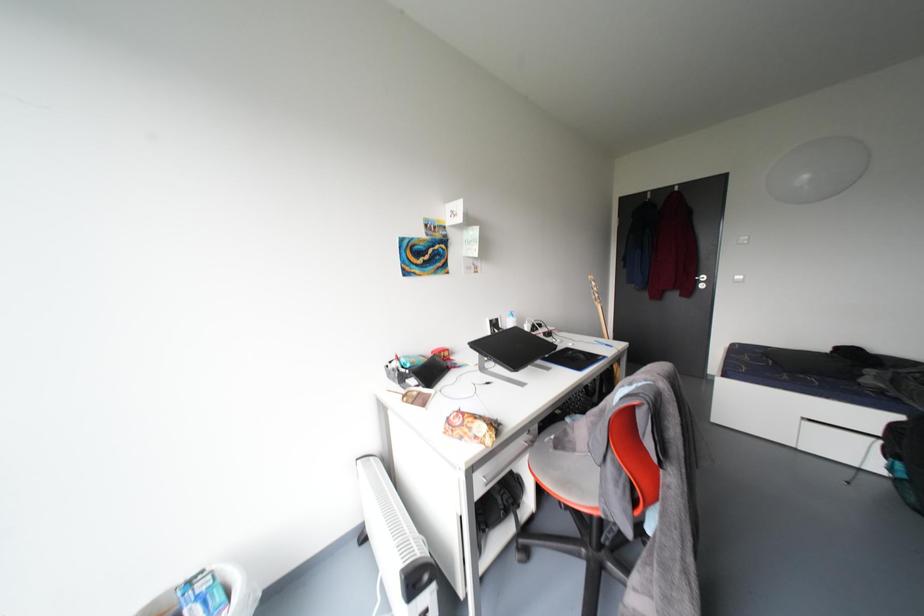
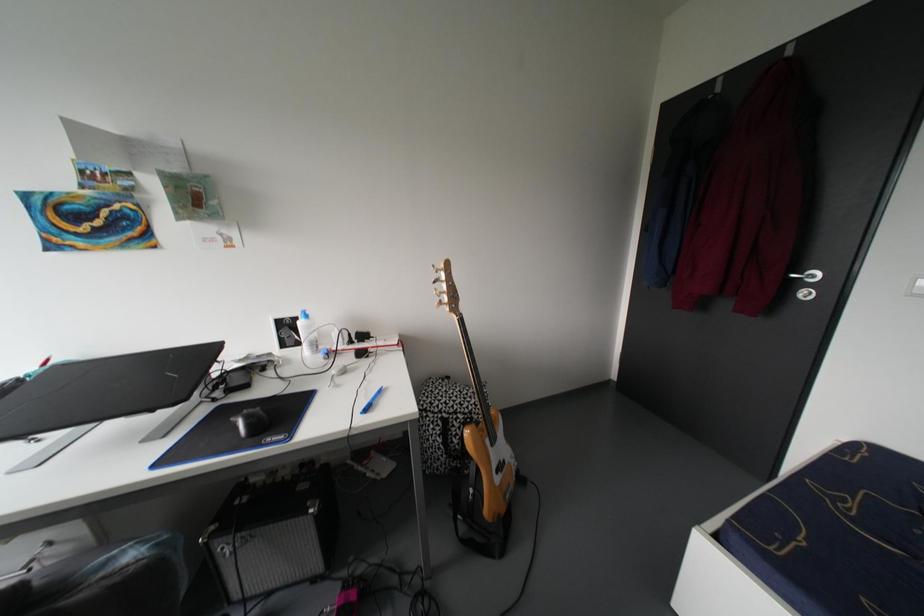
In a continuous first-person perspective shot, in which direction is the camera moving?

The movement direction of the cameraman is right, forward.